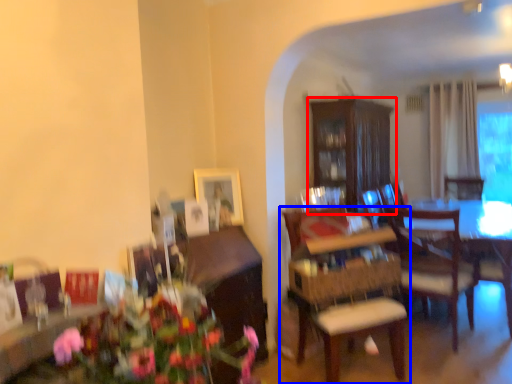
Question: Which of the following is the closest to the observer, cabinetry (highlighted by a red box) or chair (highlighted by a blue box)?

Choices:
 (A) cabinetry
 (B) chair

Answer: (B)